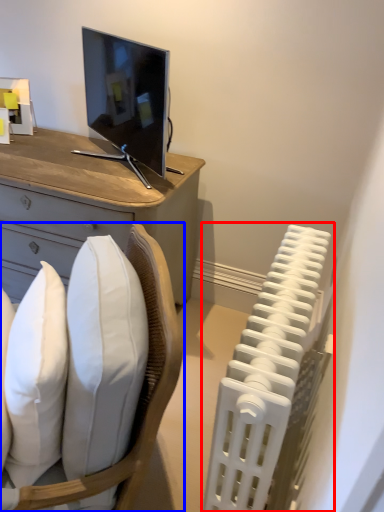
Question: Among these objects, which one is farthest to the camera, radiator (highlighted by a red box) or chair (highlighted by a blue box)?

Choices:
 (A) radiator
 (B) chair

Answer: (A)